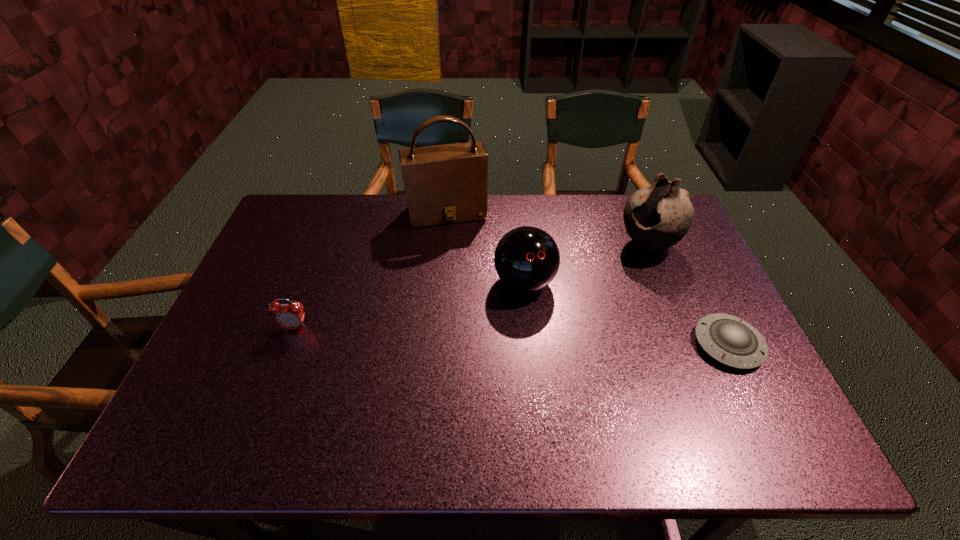
Find the location of a particular element. The image size is (960, 540). free space located 0.210m on the front flap of the tallest object is located at coordinates (467, 273).

The height and width of the screenshot is (540, 960). In order to click on free space located on the front flap of the tallest object in this screenshot , I will do `click(462, 257)`.

You are a GUI agent. You are given a task and a screenshot of the screen. Output one action in this format:
    pyautogui.click(x=<x>, y=<y>)
    Task: Click on the free space located 0.170m on the front flap of the tallest object
    Image resolution: width=960 pixels, height=540 pixels.
    Given the screenshot: What is the action you would take?
    pyautogui.click(x=464, y=264)

Locate an element on the screen. vacant space positioned 0.050m on the surface of the bowling ball near the finger holes is located at coordinates (540, 319).

Where is `free spot located on the surface of the bowling ball near the finger holes`? The width and height of the screenshot is (960, 540). free spot located on the surface of the bowling ball near the finger holes is located at coordinates (582, 410).

Identify the location of free location located 0.150m on the surface of the bowling ball near the finger holes. (554, 349).

I want to click on vacant space located from the spout of the pottery, so click(x=586, y=286).

In order to click on vacant space located from the spout of the pottery in this screenshot , I will do `click(553, 308)`.

This screenshot has height=540, width=960. In order to click on free spot located 0.100m from the spout of the pottery in this screenshot , I will do `click(606, 272)`.

I want to click on shoulder bag that is at the far edge, so click(x=448, y=183).